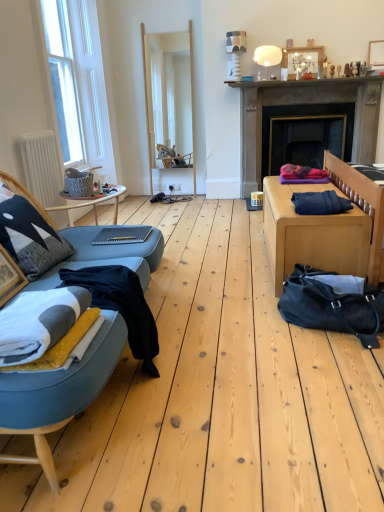
Where is `free space above white matte radiator at left (from a real-world perspective)`? The image size is (384, 512). free space above white matte radiator at left (from a real-world perspective) is located at coordinates (32, 130).